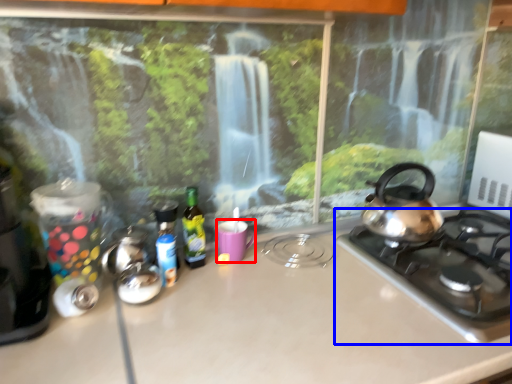
Question: Which object appears closest to the camera in this image, mug (highlighted by a red box) or gas stove (highlighted by a blue box)?

Choices:
 (A) mug
 (B) gas stove

Answer: (B)